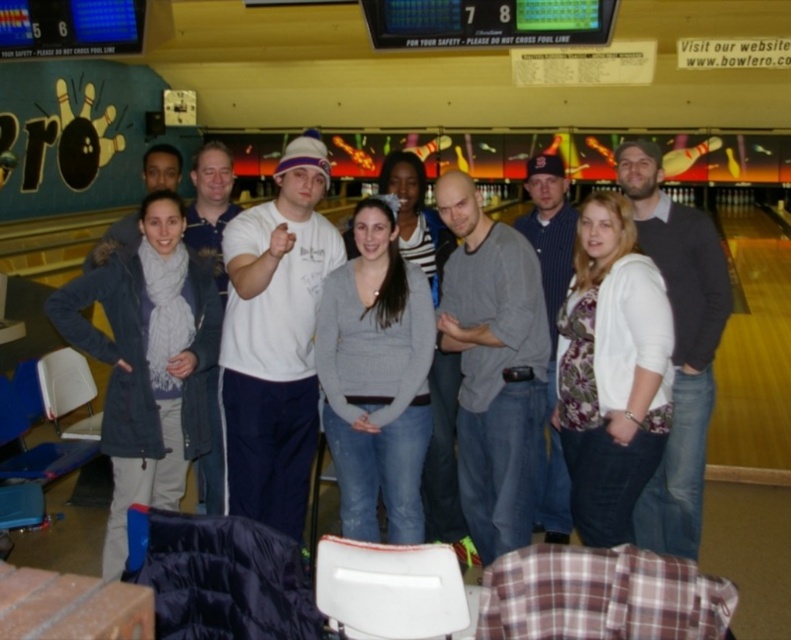
Is floral print sweater at center to the right of gray cotton shirt at center from the viewer's perspective?

Correct, you'll find floral print sweater at center to the right of gray cotton shirt at center.

Does point (661, 435) come farther from viewer compared to point (491, 250)?

No, (661, 435) is in front of (491, 250).

Which is in front, point (631, 266) or point (479, 266)?

Point (631, 266) is more forward.

This screenshot has width=791, height=640. What are the coordinates of `floral print sweater at center` in the screenshot? It's located at (611, 371).

Is point (619, 344) positioned in front of point (360, 474)?

That is True.

How distant is floral print sweater at center from gray sweater at center?

floral print sweater at center and gray sweater at center are 34.01 inches apart from each other.

Find the location of a particular element. floral print sweater at center is located at coordinates (611, 371).

Which is in front, point (557, 417) or point (199, 189)?

Point (557, 417) is more forward.

Is floral print sweater at center below white cotton shirt at center?

Correct, floral print sweater at center is located below white cotton shirt at center.

Where is `floral print sweater at center`? The height and width of the screenshot is (640, 791). floral print sweater at center is located at coordinates (x=611, y=371).

Locate an element on the screen. Image resolution: width=791 pixels, height=640 pixels. floral print sweater at center is located at coordinates (611, 371).